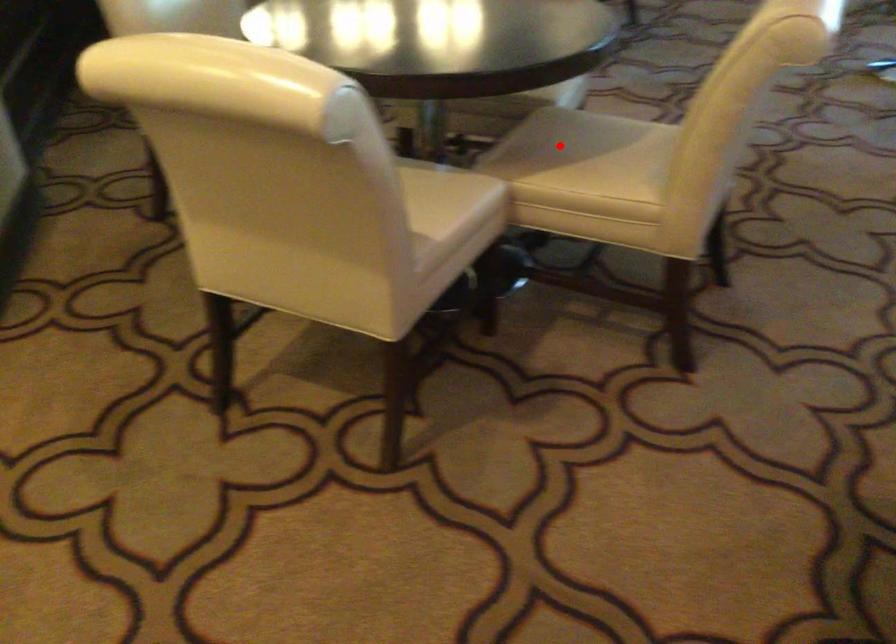
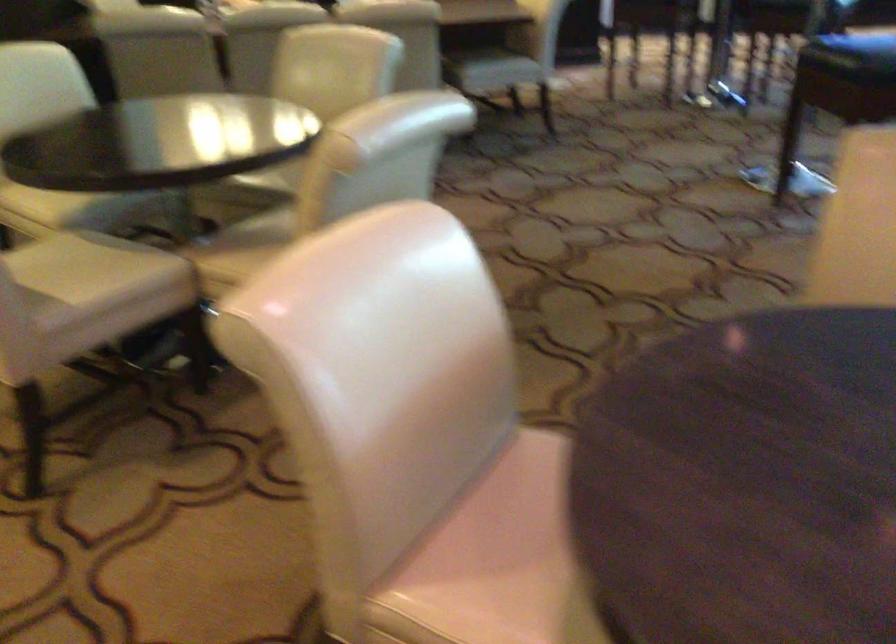
Question: I am providing you with two images of the same scene from different viewpoints. In image1, a red point is highlighted. Considering the same 3D point in image2, which of the following is correct?

Choices:
 (A) It is closer
 (B) It is farther

Answer: (B)